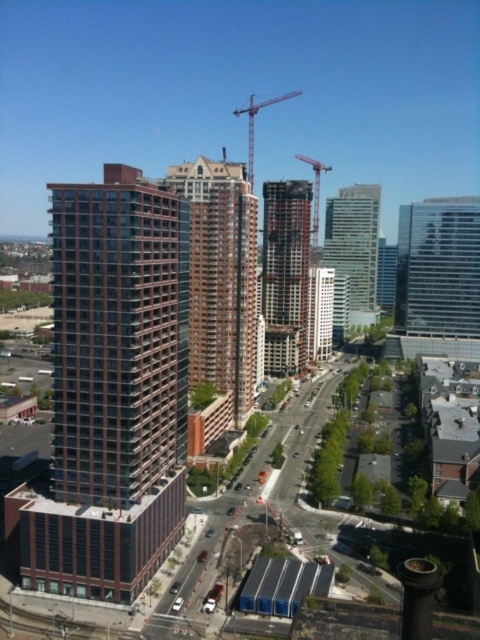
You are a delivery drone flying over the urban landscape. You need to deliver a package to the dark brown concrete building at center. However, there is a metallic gray crane at upper center in your path. Based on the scene, can you safely fly under the crane to reach the building?

The dark brown concrete building at center is below the metallic gray crane at upper center, so yes, the drone can safely fly under the crane to reach the building.

You are standing at the center of the urban landscape and want to locate the matte glass building at center. According to the coordinates provided, where exactly would you find it?

The matte glass building at center is located at point coordinates (x=320, y=312).

You are standing in the urban landscape described and want to determine which of the two points, point (319, 305) or point (302, 161), is nearer to you. Based on the scene details, which point is closer?

Point (319, 305) is closer to the viewer than point (302, 161).